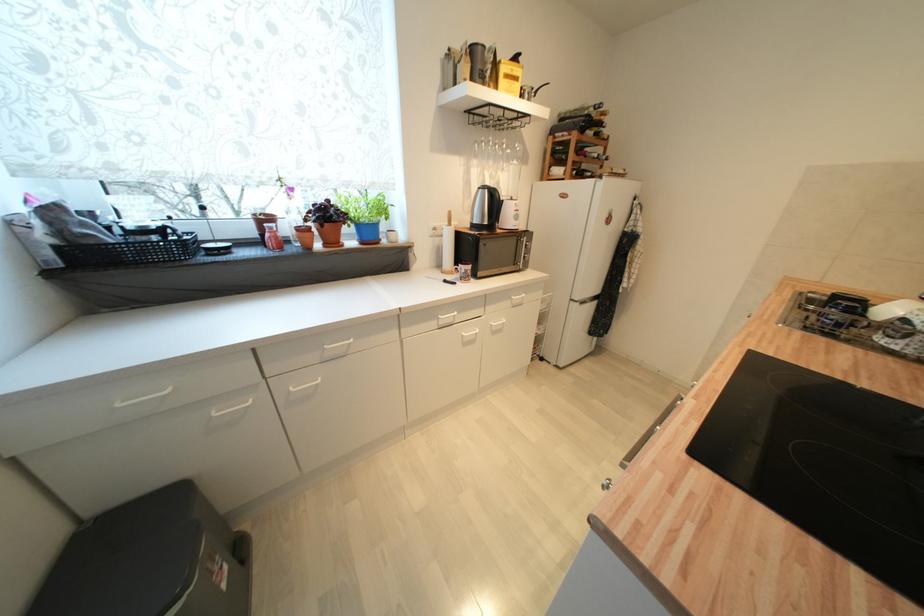
The width and height of the screenshot is (924, 616). Identify the location of microwave door handle. (502, 257).